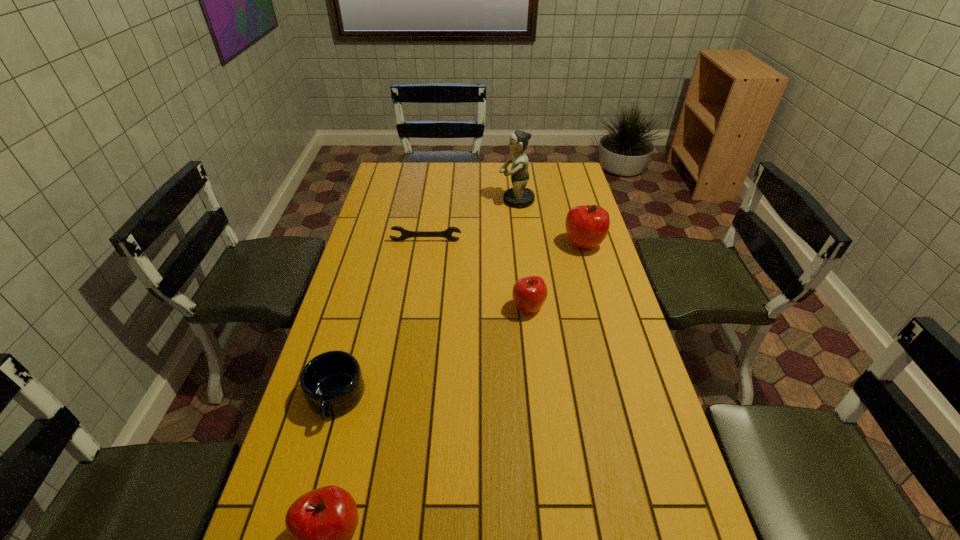
Image resolution: width=960 pixels, height=540 pixels. What are the coordinates of `free spot between the tallest object and the shortest object` in the screenshot? It's located at coord(471,221).

What are the coordinates of `object that is the fifth nearest to the rightmost apple` in the screenshot? It's located at point(321,523).

Point out which object is positioned as the second nearest to the rightmost object. Please provide its 2D coordinates. Your answer should be formatted as a tuple, i.e. [(x, y)], where the tuple contains the x and y coordinates of a point satisfying the conditions above.

[(529, 293)]

You are a GUI agent. You are given a task and a screenshot of the screen. Output one action in this format:
    pyautogui.click(x=<x>, y=<y>)
    Task: Click on the apple object that ranks as the second closest to the leftmost apple
    
    Given the screenshot: What is the action you would take?
    pyautogui.click(x=587, y=226)

Image resolution: width=960 pixels, height=540 pixels. In order to click on apple that is the closest to the farthest object in this screenshot , I will do `click(587, 226)`.

The image size is (960, 540). In order to click on free space that satisfies the following two spatial constraints: 1. on the back side of the second apple from right to left; 2. on the left side of the farthest apple in this screenshot , I will do `click(521, 245)`.

Find the location of a particular element. free space that satisfies the following two spatial constraints: 1. on the front-facing side of the second farthest apple; 2. on the right side of the figurine is located at coordinates (528, 308).